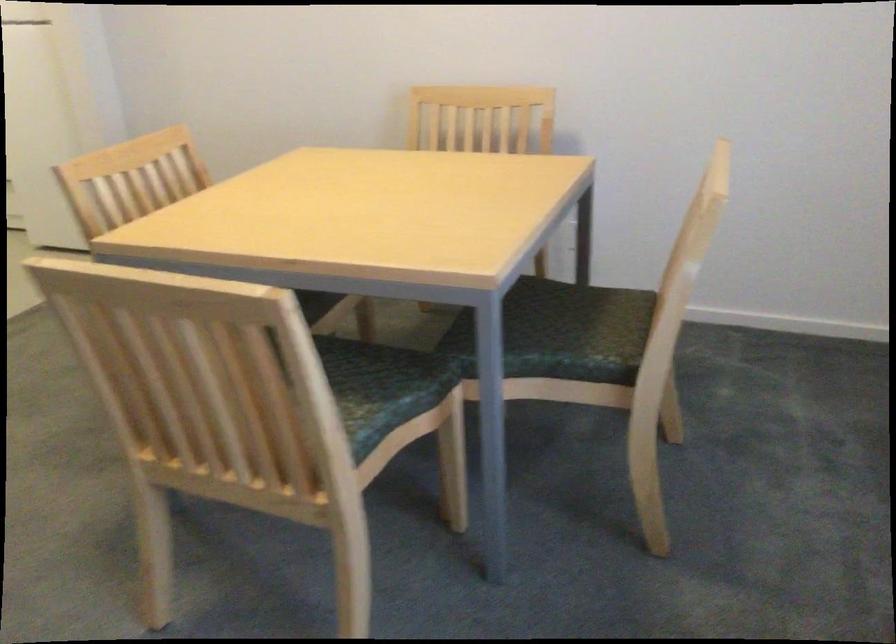
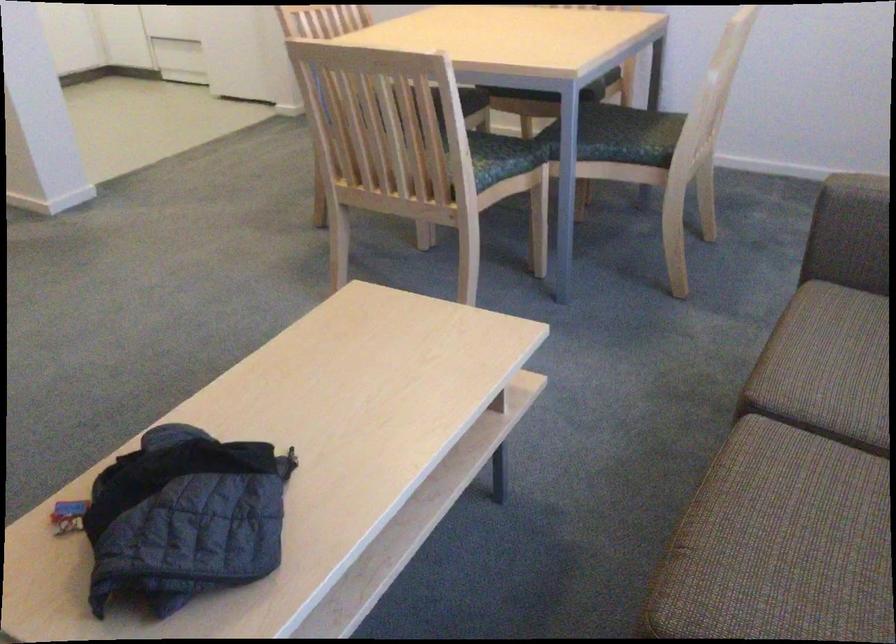
The point at (x=391, y=395) is marked in the first image. Where is the corresponding point in the second image?

(501, 158)